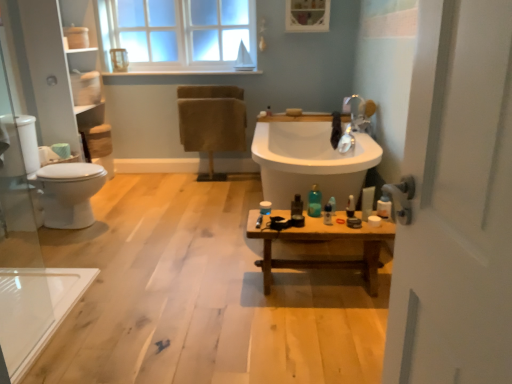
Question: Does white glossy toilet at left appear on the left side of translucent plastic bottle at center, positioned as the 1th toiletry in left-to-right order?

Choices:
 (A) yes
 (B) no

Answer: (A)

Question: Is translucent plastic bottle at center, positioned as the 1th toiletry in left-to-right order, at the back of white glossy toilet at left?

Choices:
 (A) yes
 (B) no

Answer: (B)

Question: From a real-world perspective, is white glossy toilet at left on top of translucent plastic bottle at center, which is the 6th toiletry in right-to-left order?

Choices:
 (A) yes
 (B) no

Answer: (B)

Question: Is white glossy toilet at left closer to the viewer compared to translucent plastic bottle at center, which is the 6th toiletry in right-to-left order?

Choices:
 (A) no
 (B) yes

Answer: (A)

Question: Considering the relative sizes of white glossy toilet at left and translucent plastic bottle at center, positioned as the 1th toiletry in left-to-right order, in the image provided, is white glossy toilet at left shorter than translucent plastic bottle at center, positioned as the 1th toiletry in left-to-right order,?

Choices:
 (A) no
 (B) yes

Answer: (A)

Question: Is wooden bench at center inside the boundaries of clear glass window at upper center, or outside?

Choices:
 (A) inside
 (B) outside

Answer: (B)

Question: Considering the positions of point (289, 284) and point (152, 46), is point (289, 284) closer or farther from the camera than point (152, 46)?

Choices:
 (A) closer
 (B) farther

Answer: (A)

Question: Relative to clear glass window at upper center, is wooden bench at center in front or behind?

Choices:
 (A) behind
 (B) front

Answer: (B)

Question: In terms of height, does wooden bench at center look taller or shorter compared to clear glass window at upper center?

Choices:
 (A) short
 (B) tall

Answer: (A)

Question: Do you think transparent glass door at left is within translucent plastic bottle at right, acting as the 2th toiletry starting from the right, or outside of it?

Choices:
 (A) inside
 (B) outside

Answer: (B)

Question: From the image's perspective, is transparent glass door at left located above or below translucent plastic bottle at right, which is the 5th toiletry from left to right?

Choices:
 (A) below
 (B) above

Answer: (A)

Question: Looking at the image, does transparent glass door at left seem bigger or smaller compared to translucent plastic bottle at right, acting as the 2th toiletry starting from the right?

Choices:
 (A) big
 (B) small

Answer: (A)

Question: Considering the positions of point (18, 180) and point (349, 196), is point (18, 180) closer or farther from the camera than point (349, 196)?

Choices:
 (A) farther
 (B) closer

Answer: (A)

Question: Looking at their shapes, would you say translucent plastic bottle at center, which is the 6th toiletry in right-to-left order, is wider or thinner than wooden bench at center?

Choices:
 (A) thin
 (B) wide

Answer: (A)

Question: Does point (297, 208) appear closer or farther from the camera than point (290, 380)?

Choices:
 (A) closer
 (B) farther

Answer: (B)